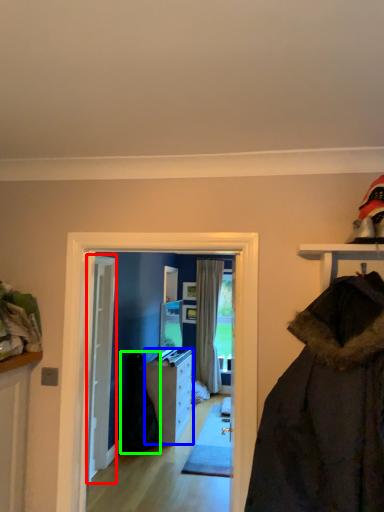
Question: Based on their relative distances, which object is farther from door (highlighted by a red box)? Choose from cabinetry (highlighted by a blue box) and garment (highlighted by a green box).

Choices:
 (A) cabinetry
 (B) garment

Answer: (A)